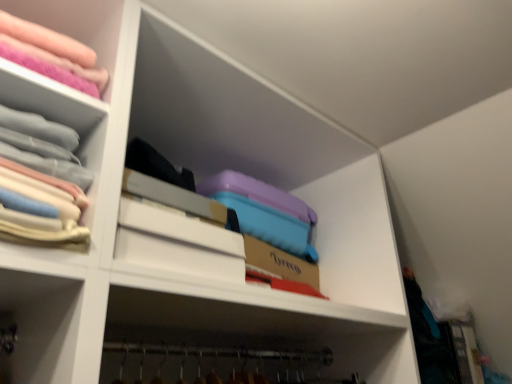
The width and height of the screenshot is (512, 384). What do you see at coordinates (59, 113) in the screenshot? I see `pastel fabric stack at upper left` at bounding box center [59, 113].

Locate an element on the screen. The image size is (512, 384). pastel fabric stack at upper left is located at coordinates (59, 113).

What do you see at coordinates (77, 24) in the screenshot?
I see `matte pink fabric at upper left` at bounding box center [77, 24].

Locate an element on the screen. matte pink fabric at upper left is located at coordinates (77, 24).

I want to click on pastel fabric stack at upper left, so click(x=59, y=113).

Which is more to the right, pastel fabric stack at upper left or matte pink fabric at upper left?

pastel fabric stack at upper left.

Is pastel fabric stack at upper left in front of or behind matte pink fabric at upper left in the image?

In the image, pastel fabric stack at upper left appears in front of matte pink fabric at upper left.

Considering the positions of points (73, 110) and (48, 0), is point (73, 110) closer to camera compared to point (48, 0)?

That is True.

From the image's perspective, would you say pastel fabric stack at upper left is positioned over matte pink fabric at upper left?

No, from the image's perspective, pastel fabric stack at upper left is not on top of matte pink fabric at upper left.

Consider the image. From a real-world perspective, is pastel fabric stack at upper left positioned under matte pink fabric at upper left based on gravity?

Yes.

Based on the photo, which object is wider, pastel fabric stack at upper left or matte pink fabric at upper left?

matte pink fabric at upper left.

Considering the relative sizes of pastel fabric stack at upper left and matte pink fabric at upper left in the image provided, is pastel fabric stack at upper left taller than matte pink fabric at upper left?

Yes, pastel fabric stack at upper left is taller than matte pink fabric at upper left.

Who is smaller, pastel fabric stack at upper left or matte pink fabric at upper left?

With smaller size is pastel fabric stack at upper left.

Is pastel fabric stack at upper left surrounding matte pink fabric at upper left?

No, matte pink fabric at upper left is not inside pastel fabric stack at upper left.

Is the surface of pastel fabric stack at upper left in direct contact with matte pink fabric at upper left?

No, pastel fabric stack at upper left is not with matte pink fabric at upper left.

Is pastel fabric stack at upper left turned away from matte pink fabric at upper left?

No, matte pink fabric at upper left is not at the back of pastel fabric stack at upper left.

In order to click on cabinet that is in front of the matte pink fabric at upper left in this screenshot , I will do `click(59, 113)`.

Which object is positioned more to the right, matte pink fabric at upper left or pastel fabric stack at upper left?

Positioned to the right is pastel fabric stack at upper left.

Which is in front, matte pink fabric at upper left or pastel fabric stack at upper left?

pastel fabric stack at upper left is in front.

Between point (113, 43) and point (34, 74), which one is positioned behind?

Positioned behind is point (113, 43).

From the image's perspective, which one is positioned higher, matte pink fabric at upper left or pastel fabric stack at upper left?

matte pink fabric at upper left, from the image's perspective.

From a real-world perspective, is matte pink fabric at upper left on pastel fabric stack at upper left?

Yes, from a real-world perspective, matte pink fabric at upper left is on top of pastel fabric stack at upper left.

Considering the relative sizes of matte pink fabric at upper left and pastel fabric stack at upper left in the image provided, is matte pink fabric at upper left wider than pastel fabric stack at upper left?

Yes.

Which of these two, matte pink fabric at upper left or pastel fabric stack at upper left, stands shorter?

Standing shorter between the two is matte pink fabric at upper left.

Based on the photo, between matte pink fabric at upper left and pastel fabric stack at upper left, which one has larger size?

Bigger between the two is matte pink fabric at upper left.

Is matte pink fabric at upper left outside of pastel fabric stack at upper left?

matte pink fabric at upper left is positioned outside pastel fabric stack at upper left.

Based on the photo, is matte pink fabric at upper left next to pastel fabric stack at upper left and touching it?

No, matte pink fabric at upper left is not beside pastel fabric stack at upper left.

Is matte pink fabric at upper left positioned with its back to pastel fabric stack at upper left?

That's not correct — matte pink fabric at upper left is not looking away from pastel fabric stack at upper left.

Can you tell me how much matte pink fabric at upper left and pastel fabric stack at upper left differ in facing direction?

The angular difference between matte pink fabric at upper left and pastel fabric stack at upper left is 6.51 degrees.

The image size is (512, 384). I want to click on shelf lying above the pastel fabric stack at upper left (from the image's perspective), so (77, 24).

Locate an element on the screen. Image resolution: width=512 pixels, height=384 pixels. cabinet in front of the matte pink fabric at upper left is located at coordinates (59, 113).

This screenshot has height=384, width=512. I want to click on shelf that appears above the pastel fabric stack at upper left (from a real-world perspective), so click(77, 24).